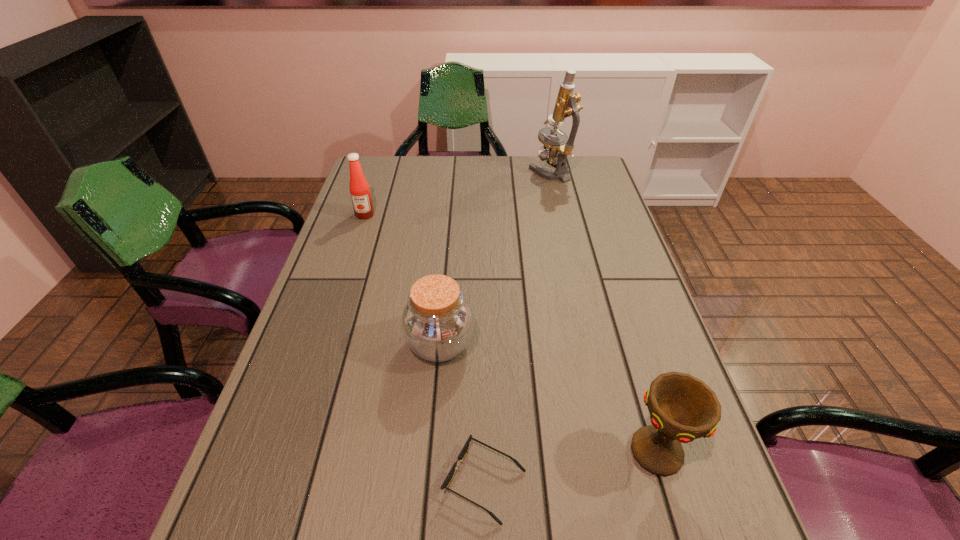
Where is `free space located 0.190m on the front of the third nearest object`? The height and width of the screenshot is (540, 960). free space located 0.190m on the front of the third nearest object is located at coordinates (430, 462).

Locate an element on the screen. free space located 0.230m on the lenses of the sunglasses is located at coordinates (311, 482).

Locate an element on the screen. free point located 0.340m on the lenses of the sunglasses is located at coordinates (249, 482).

This screenshot has width=960, height=540. In order to click on vacant space located on the lenses of the sunglasses in this screenshot , I will do `click(402, 482)`.

This screenshot has height=540, width=960. Identify the location of object present at the far edge. (555, 150).

Identify the location of object located at the left edge. (362, 202).

Where is `microscope at the right edge`? microscope at the right edge is located at coordinates (555, 150).

Where is `chalice at the right edge`? chalice at the right edge is located at coordinates (682, 408).

Locate an element on the screen. The image size is (960, 540). object at the far right corner is located at coordinates (555, 150).

In order to click on vacant space at the far edge in this screenshot , I will do `click(419, 173)`.